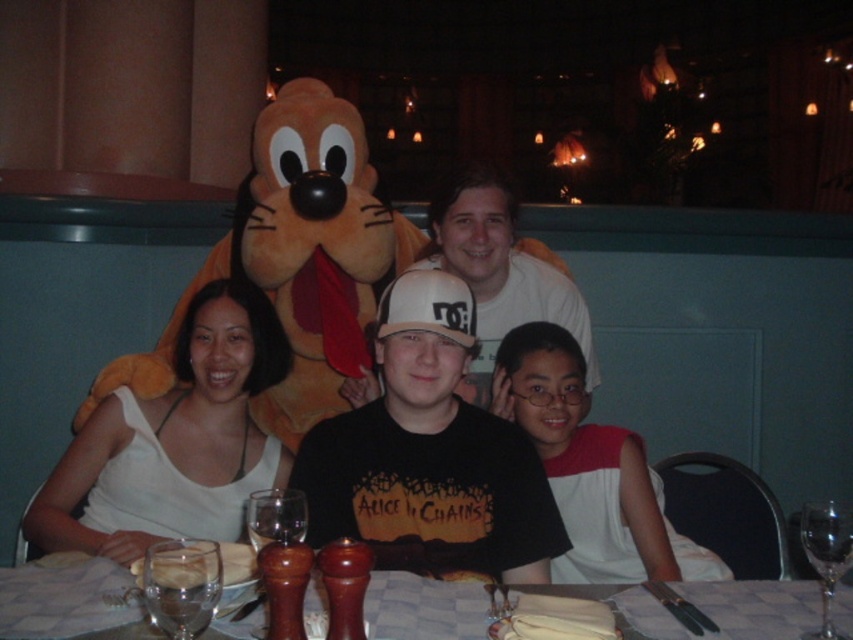
Question: Does wooden table at center have a greater width compared to white matte shirt at center?

Choices:
 (A) yes
 (B) no

Answer: (A)

Question: Estimate the real-world distances between objects in this image. Which object is closer to the white fabric shirt at center?

Choices:
 (A) white matte shirt at center
 (B) wooden table at center

Answer: (B)

Question: Which is farther from the wooden table at center?

Choices:
 (A) white matte shirt at center
 (B) white fabric shirt at center

Answer: (A)

Question: Is white fabric shirt at center below white matte shirt at center?

Choices:
 (A) yes
 (B) no

Answer: (B)

Question: Does wooden table at center come in front of white matte shirt at center?

Choices:
 (A) yes
 (B) no

Answer: (A)

Question: Which point is closer to the camera?

Choices:
 (A) wooden table at center
 (B) white fabric shirt at center

Answer: (A)